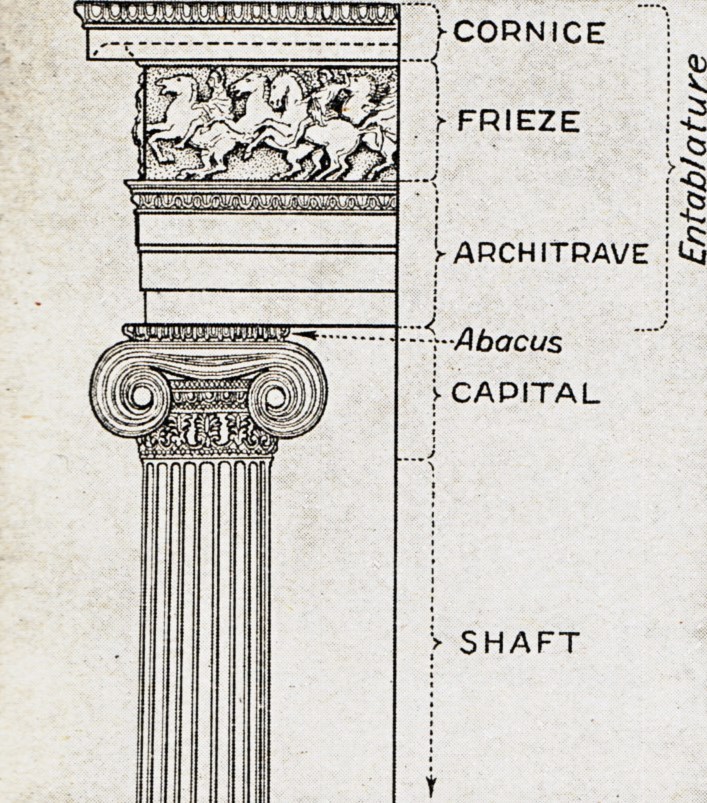
The width and height of the screenshot is (707, 803). Find the location of `pillar`. pillar is located at coordinates (223, 641).